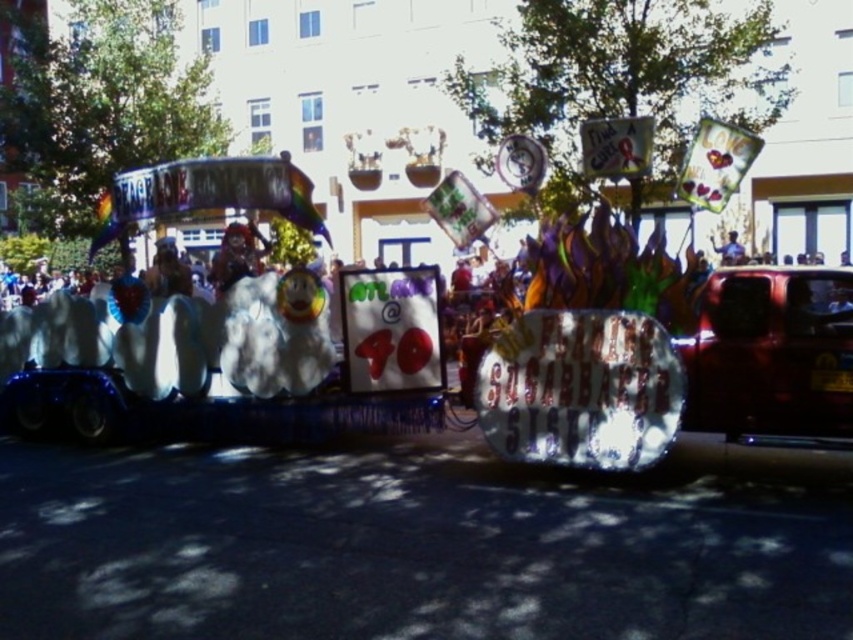
Question: Which of the following is the farthest from the observer?

Choices:
 (A) shiny red car at right
 (B) blue fabric shirt at center

Answer: (B)

Question: Which point is closer to the camera taking this photo?

Choices:
 (A) (717, 380)
 (B) (728, 240)

Answer: (A)

Question: Is shiny red car at right positioned before blue fabric shirt at center?

Choices:
 (A) yes
 (B) no

Answer: (A)

Question: Does shiny red car at right have a lesser width compared to blue fabric shirt at center?

Choices:
 (A) no
 (B) yes

Answer: (A)

Question: Which point is closer to the camera taking this photo?

Choices:
 (A) (724, 260)
 (B) (691, 419)

Answer: (B)

Question: Does shiny red car at right have a smaller size compared to blue fabric shirt at center?

Choices:
 (A) no
 (B) yes

Answer: (B)